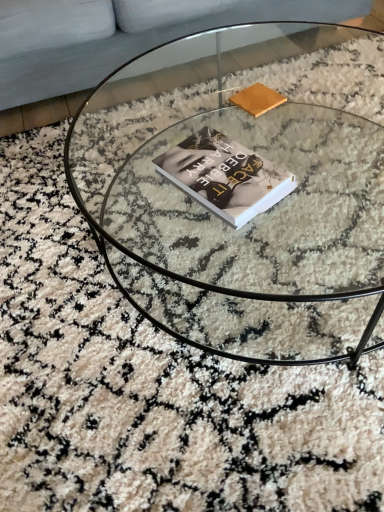
You are a GUI agent. You are given a task and a screenshot of the screen. Output one action in this format:
    pyautogui.click(x=<x>, y=<y>)
    Task: Click on the vacant space to the right of hardcover book at center
    The image size is (384, 512).
    Given the screenshot: What is the action you would take?
    pyautogui.click(x=302, y=170)